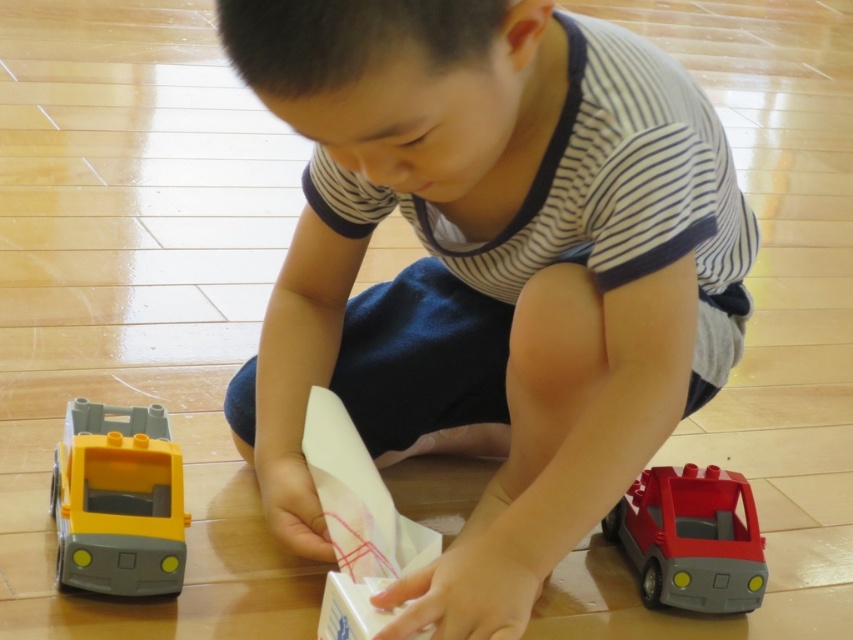
Question: From the image, what is the correct spatial relationship of yellow plastic truck at lower left in relation to matte red plastic toy car at lower right?

Choices:
 (A) below
 (B) above

Answer: (B)

Question: Can you confirm if matte plastic boy at center is smaller than matte red plastic toy car at lower right?

Choices:
 (A) yes
 (B) no

Answer: (B)

Question: Based on their relative distances, which object is farther from the matte red plastic toy car at lower right?

Choices:
 (A) matte plastic boy at center
 (B) yellow plastic truck at lower left

Answer: (B)

Question: Which point is farther to the camera?

Choices:
 (A) (637, 289)
 (B) (656, 486)

Answer: (B)

Question: Which object is farther from the camera taking this photo?

Choices:
 (A) matte plastic boy at center
 (B) yellow plastic truck at lower left

Answer: (B)

Question: Is matte plastic boy at center below yellow plastic truck at lower left?

Choices:
 (A) yes
 (B) no

Answer: (B)